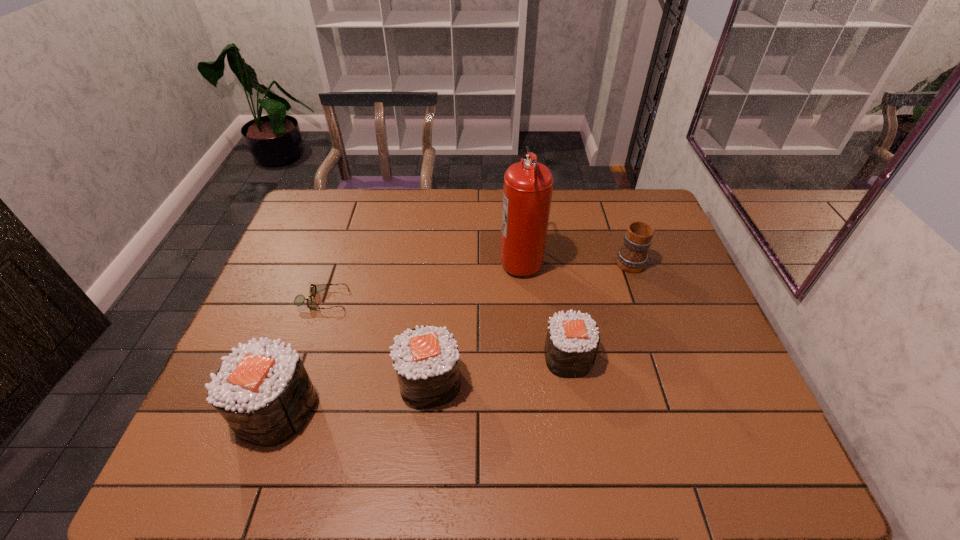
Find the location of `free space located on the right of the shortest sushi`. free space located on the right of the shortest sushi is located at coordinates pyautogui.click(x=663, y=357).

Where is `vacant space located on the side of the mug with the handle`? The width and height of the screenshot is (960, 540). vacant space located on the side of the mug with the handle is located at coordinates (616, 222).

What are the coordinates of `vacant space located on the side of the mug with the handle` in the screenshot? It's located at (620, 234).

Identify the location of free location located on the side of the mug with the handle. This screenshot has height=540, width=960. (608, 199).

Locate an element on the screen. vacant space located on the instruction side of the fire extinguisher is located at coordinates (371, 258).

Identify the location of vacant space located on the instruction side of the fire extinguisher. This screenshot has width=960, height=540. (451, 258).

Where is `vacant space located on the instruction side of the fire extinguisher`? This screenshot has height=540, width=960. vacant space located on the instruction side of the fire extinguisher is located at coordinates (448, 258).

Locate an element on the screen. Image resolution: width=960 pixels, height=540 pixels. free space located 0.180m on the front-facing side of the spectacles is located at coordinates (412, 300).

Identify the location of sushi at the left edge. (263, 391).

Locate an element on the screen. This screenshot has width=960, height=540. spectacles located at the left edge is located at coordinates (299, 300).